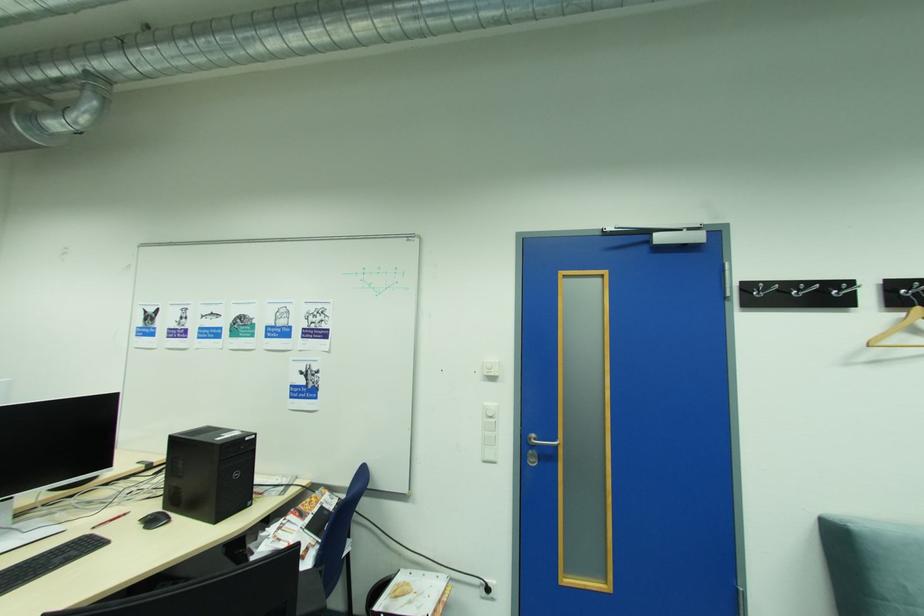
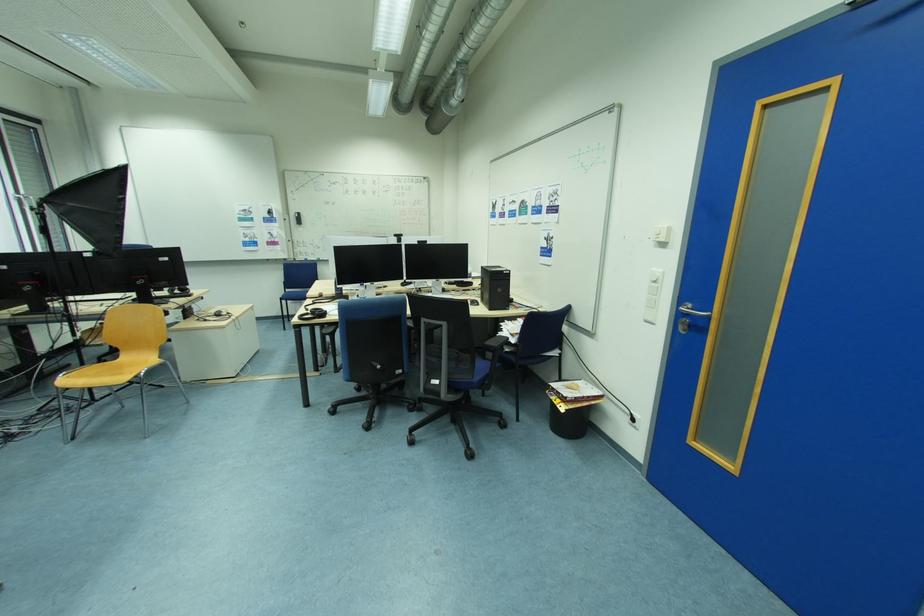
The point at (495, 371) is marked in the first image. Where is the corresponding point in the second image?

(664, 237)